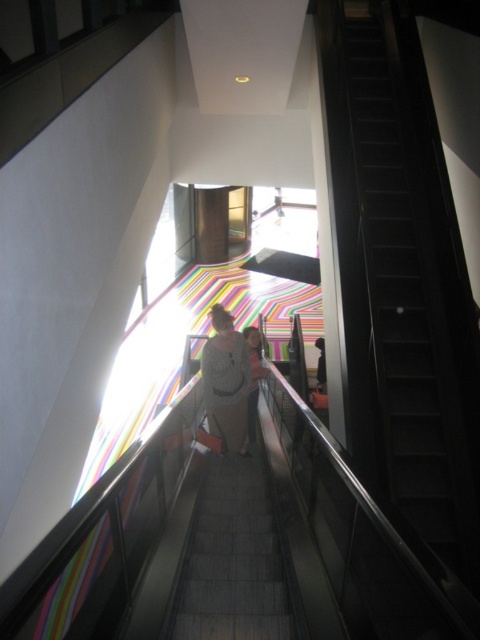
You are a delivery person carrying a large package that is 1.8 meters long. You need to move from the white textured shirt at center to the black metal stairs at upper right. Is there enough space between them to maneuver the package without tilting it?

The distance between the black metal stairs at upper right and the white textured shirt at center is 1.83 meters. Since the package is 1.8 meters long, there is enough space to maneuver it without tilting.

You are a delivery person carrying a package and need to place it on a shelf near the white cotton shirt at center. The shelf is 2 meters away from the black metal stairs at upper right. Can you reach the shelf from the stairs without moving the shirt?

The black metal stairs at upper right is 2.63 meters from the white cotton shirt at center. Since the shelf is 2 meters away from the stairs, it is closer than the shirt, so you can reach the shelf without moving the shirt.

You are standing in the modern architectural space and want to reach the colorful striped pattern at the top of the stairs. Which object, the black metal stairs at upper right or the white textured shirt at center, should you approach first?

You should approach the black metal stairs at upper right first because it is closer to you than the white textured shirt at center, so you can reach the stairs more quickly to get to the top where the pattern is located.